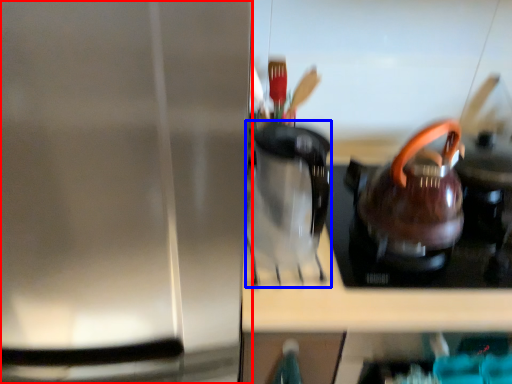
Question: Which point is further to the camera, kitchen appliance (highlighted by a red box) or coffeepot (highlighted by a blue box)?

Choices:
 (A) kitchen appliance
 (B) coffeepot

Answer: (B)